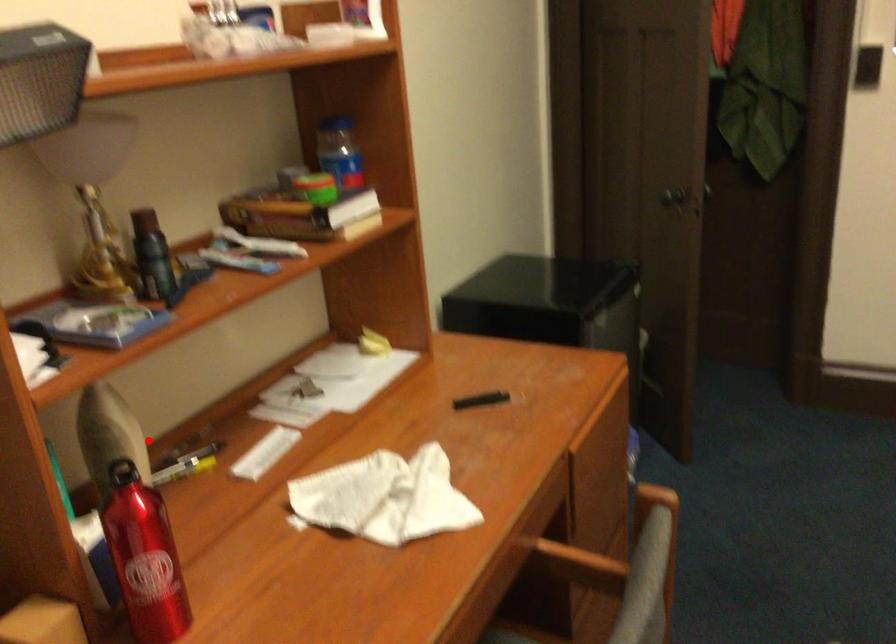
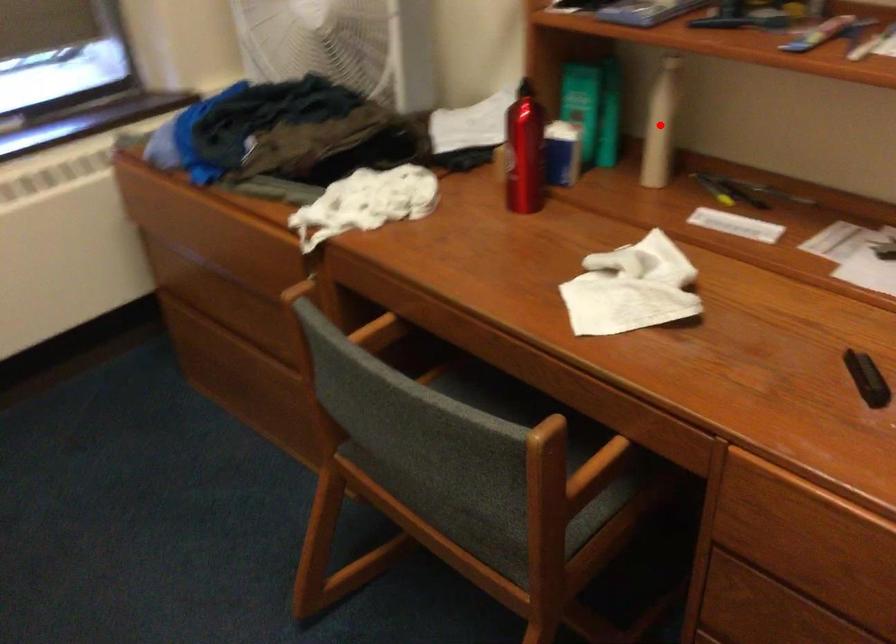
I am providing you with two images of the same scene from different viewpoints. A red point is marked on the first image and another point is marked on the second image. Do the highlighted points in image1 and image2 indicate the same real-world spot?

Yes